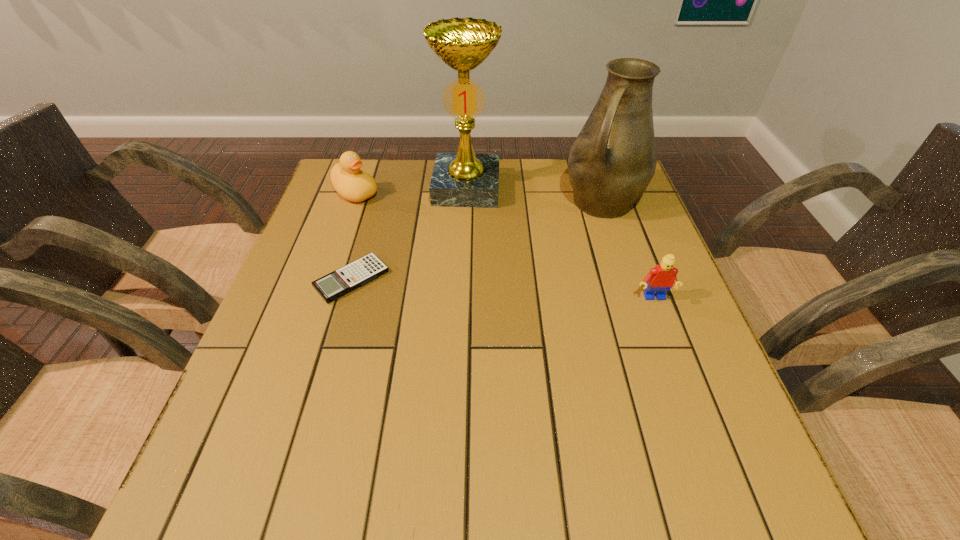
At what (x,y) coordinates should I click in order to perform the action: click on the shortest object. Please return your answer as a coordinate pair (x, y). The width and height of the screenshot is (960, 540). Looking at the image, I should click on (338, 283).

Where is `Lego`? Lego is located at coordinates (661, 278).

Locate an element on the screen. The image size is (960, 540). award is located at coordinates (464, 179).

At what (x,y) coordinates should I click in order to perform the action: click on duck. Please return your answer as a coordinate pair (x, y). Looking at the image, I should click on pos(353,184).

In order to click on the fourth shortest object in this screenshot , I will do (613, 159).

This screenshot has width=960, height=540. I want to click on vacant space situated on the back of the calculator, so click(x=376, y=194).

The width and height of the screenshot is (960, 540). Identify the location of free spot located on the front-facing side of the Lego. (699, 423).

What are the coordinates of `vacant space situated 0.350m on the front-facing side of the third object from left to right` in the screenshot? It's located at (452, 304).

You are a GUI agent. You are given a task and a screenshot of the screen. Output one action in this format:
    pyautogui.click(x=<x>, y=<y>)
    Task: Click on the free point located 0.270m on the front-facing side of the third object from left to right
    
    Given the screenshot: What is the action you would take?
    pyautogui.click(x=456, y=278)

Find the location of a particular element. blank space located on the front-facing side of the third object from left to right is located at coordinates (456, 275).